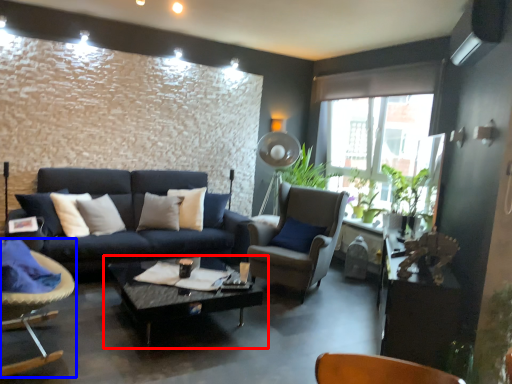
Question: Which of the following is the closest to the observer, coffee table (highlighted by a red box) or chair (highlighted by a blue box)?

Choices:
 (A) coffee table
 (B) chair

Answer: (B)